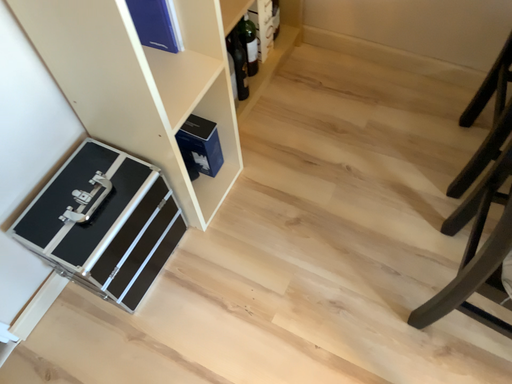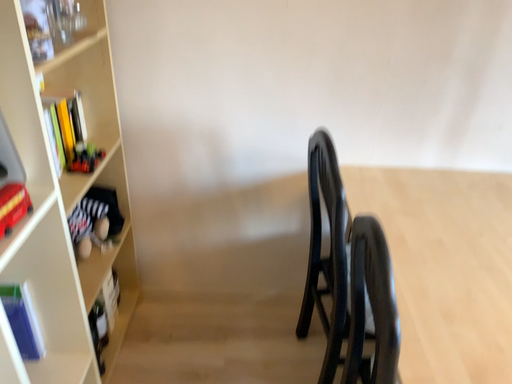
Question: Which way did the camera rotate in the video?

Choices:
 (A) rotated left
 (B) rotated right

Answer: (B)